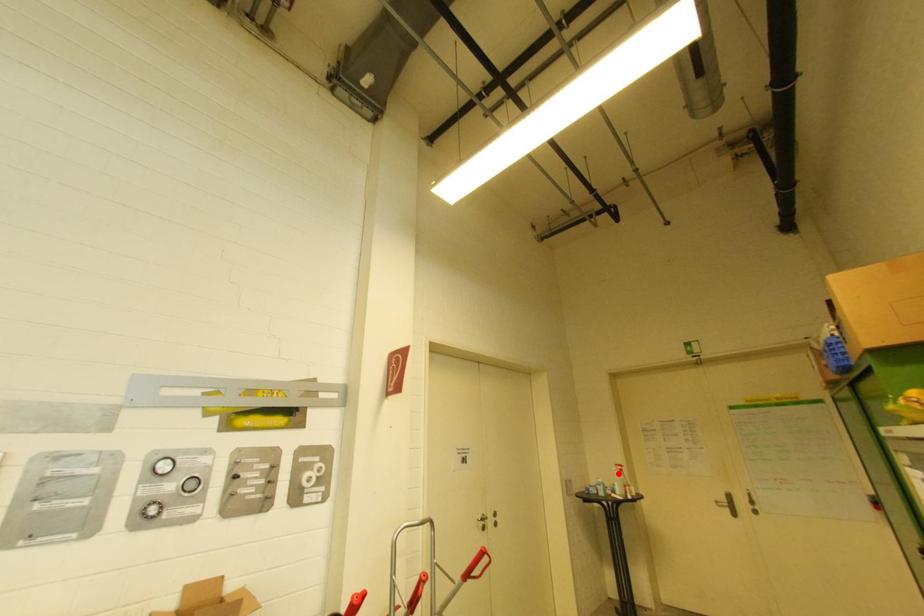
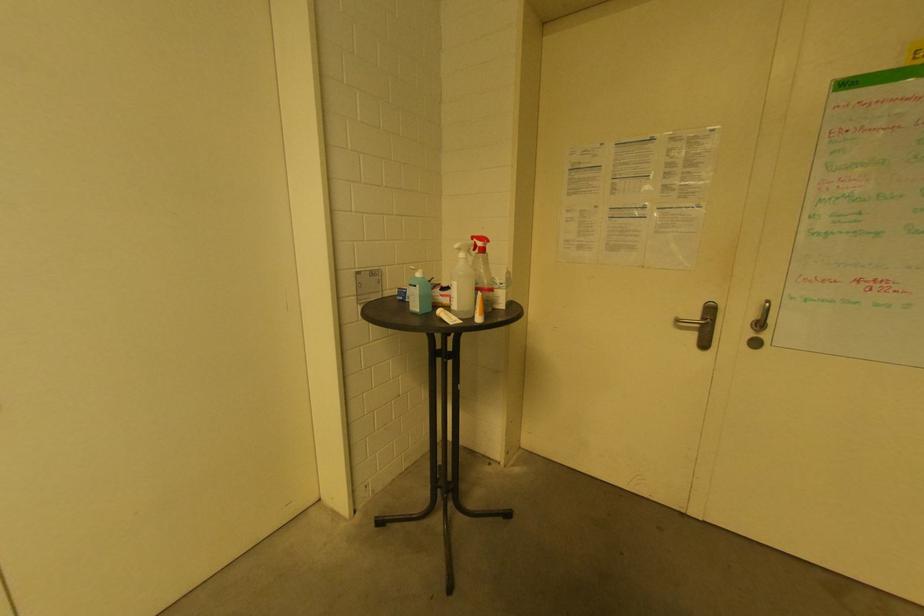
Find the pixel in the second image that matches the highlighted location in the first image.

(464, 256)